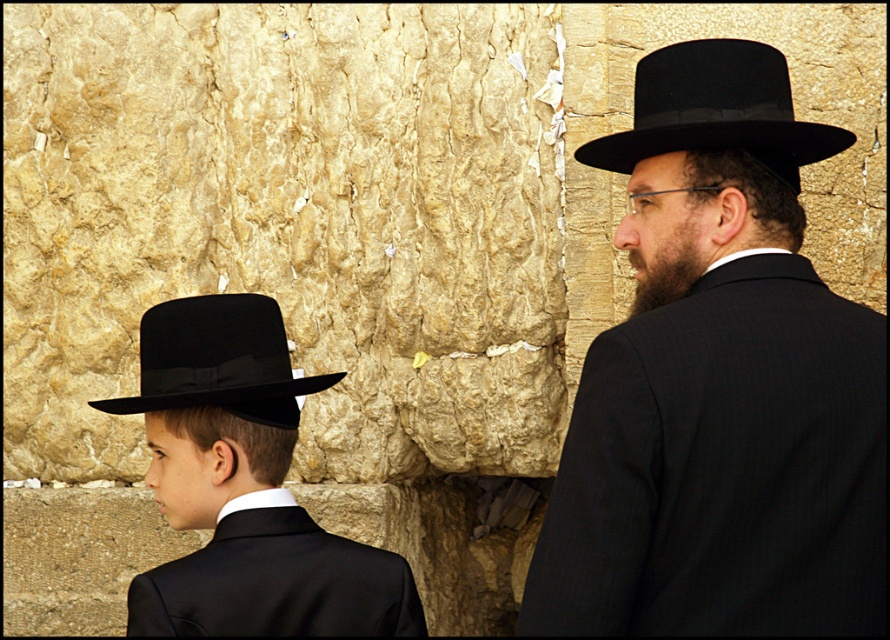
The height and width of the screenshot is (640, 890). What do you see at coordinates (276, 580) in the screenshot?
I see `black matte suit at lower left` at bounding box center [276, 580].

Does point (329, 534) lie in front of point (198, 324)?

No, it is behind (198, 324).

At what (x,y) coordinates should I click in order to perform the action: click on black matte suit at lower left. Please return your answer as a coordinate pair (x, y). This screenshot has height=640, width=890. Looking at the image, I should click on (276, 580).

Does matte black hat at left have a greater width compared to black felt fedora at upper right?

Incorrect, matte black hat at left's width does not surpass black felt fedora at upper right's.

Can you confirm if matte black hat at left is smaller than black felt fedora at upper right?

Yes.

In order to click on matte black hat at left in this screenshot , I will do `click(244, 486)`.

The height and width of the screenshot is (640, 890). In order to click on matte black hat at left in this screenshot , I will do `click(244, 486)`.

Can you confirm if matte black hat at left is smaller than black felt hat at left?

Yes, matte black hat at left is smaller than black felt hat at left.

Measure the distance between matte black hat at left and camera.

A distance of 91.55 feet exists between matte black hat at left and camera.

Which is in front, point (419, 628) or point (160, 388)?

Point (419, 628) is in front.

You are a GUI agent. You are given a task and a screenshot of the screen. Output one action in this format:
    pyautogui.click(x=<x>, y=<y>)
    Task: Click on the matte black hat at left
    
    Given the screenshot: What is the action you would take?
    pyautogui.click(x=244, y=486)